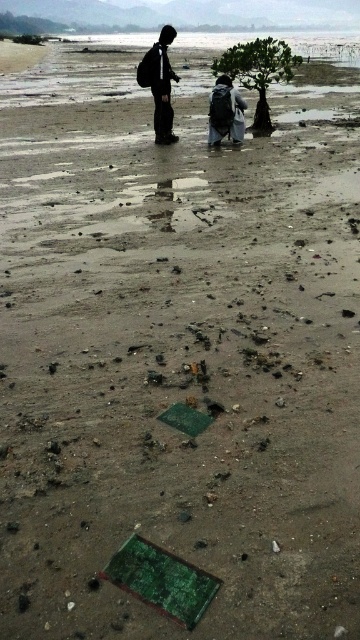
Question: Which of the following is the closest to the observer?

Choices:
 (A) (227, 120)
 (B) (165, 136)
 (C) (281, 77)

Answer: (A)

Question: Observing the image, what is the correct spatial positioning of black matte backpack at upper center in reference to dark gray backpack at center?

Choices:
 (A) above
 (B) below

Answer: (A)

Question: Which of these objects is positioned farthest from the dark gray backpack at center?

Choices:
 (A) black matte backpack at upper center
 (B) green leafy tree at center

Answer: (B)

Question: Observing the image, what is the correct spatial positioning of green leafy tree at center in reference to dark gray backpack at center?

Choices:
 (A) above
 (B) below

Answer: (A)

Question: Does green leafy tree at center appear under black matte backpack at upper center?

Choices:
 (A) yes
 (B) no

Answer: (B)

Question: Which object appears farthest from the camera in this image?

Choices:
 (A) black matte backpack at upper center
 (B) green leafy tree at center
 (C) dark gray backpack at center

Answer: (B)